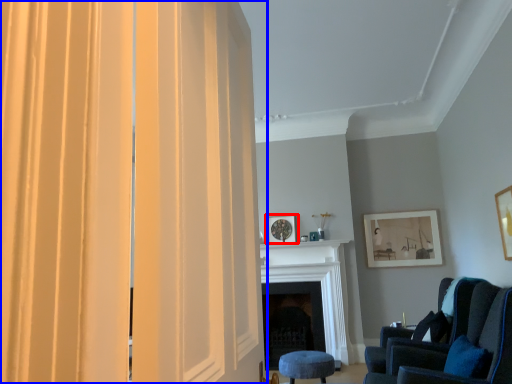
Question: Which object is further to the camera taking this photo, picture frame (highlighted by a red box) or curtain (highlighted by a blue box)?

Choices:
 (A) picture frame
 (B) curtain

Answer: (A)